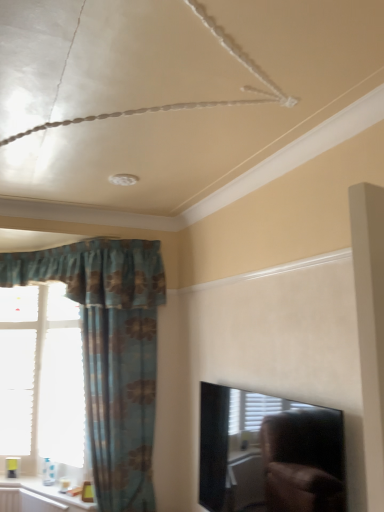
At what (x,y) coordinates should I click in order to perform the action: click on blue floral fabric curtain at left. Please return your answer as a coordinate pair (x, y). Looking at the image, I should click on coord(111,353).

Find the location of a particular element. white paper at left is located at coordinates (41, 377).

The height and width of the screenshot is (512, 384). I want to click on black glossy tv at upper right, so click(269, 454).

Find the location of a particular element. This screenshot has width=384, height=512. blue floral fabric curtain at left is located at coordinates (111, 353).

Can you confirm if white glossy window sill at lower left is thinner than blue floral fabric curtain at left?

No, white glossy window sill at lower left is not thinner than blue floral fabric curtain at left.

Is blue floral fabric curtain at left inside white glossy window sill at lower left?

No, blue floral fabric curtain at left is not a part of white glossy window sill at lower left.

From a real-world perspective, who is located lower, white glossy window sill at lower left or blue floral fabric curtain at left?

white glossy window sill at lower left.

Who is smaller, white paper at left or white glossy window sill at lower left?

white glossy window sill at lower left.

Is white paper at left behind white glossy window sill at lower left?

Yes, it is.

From the image's perspective, is white paper at left under white glossy window sill at lower left?

No.

Is blue floral fabric curtain at left next to white paper at left and touching it?

No, blue floral fabric curtain at left is not with white paper at left.

In the scene shown: Would you say blue floral fabric curtain at left contains white paper at left?

No, white paper at left is not a part of blue floral fabric curtain at left.

From the image's perspective, between blue floral fabric curtain at left and white paper at left, who is located below?

From the image's view, white paper at left is below.

Considering the sizes of blue floral fabric curtain at left and white paper at left in the image, is blue floral fabric curtain at left wider or thinner than white paper at left?

Clearly, blue floral fabric curtain at left has more width compared to white paper at left.

From a real-world perspective, does blue floral fabric curtain at left stand above black glossy tv at upper right?

Yes, from a real-world perspective, blue floral fabric curtain at left is on top of black glossy tv at upper right.

Considering the sizes of objects blue floral fabric curtain at left and black glossy tv at upper right in the image provided, who is smaller, blue floral fabric curtain at left or black glossy tv at upper right?

black glossy tv at upper right is smaller.

From the image's perspective, is blue floral fabric curtain at left below black glossy tv at upper right?

Incorrect, from the image's perspective, blue floral fabric curtain at left is higher than black glossy tv at upper right.

From a real-world perspective, which object rests below the other?

white paper at left is physically lower.

At what (x,y) coordinates should I click in order to perform the action: click on window lying behind the blue floral fabric curtain at left. Please return your answer as a coordinate pair (x, y). Image resolution: width=384 pixels, height=512 pixels. Looking at the image, I should click on (41, 377).

Is white paper at left positioned behind blue floral fabric curtain at left?

Yes, the depth of white paper at left is greater than that of blue floral fabric curtain at left.

Is white paper at left surrounding blue floral fabric curtain at left?

Definitely not — blue floral fabric curtain at left is not inside white paper at left.

In the image, is black glossy tv at upper right positioned in front of or behind blue floral fabric curtain at left?

black glossy tv at upper right is positioned closer to the viewer than blue floral fabric curtain at left.

From a real-world perspective, between black glossy tv at upper right and blue floral fabric curtain at left, who is vertically lower?

black glossy tv at upper right is physically lower.

From the image's perspective, which one is positioned higher, black glossy tv at upper right or blue floral fabric curtain at left?

blue floral fabric curtain at left is shown above in the image.

Considering the relative sizes of white paper at left and black glossy tv at upper right in the image provided, is white paper at left smaller than black glossy tv at upper right?

No, white paper at left is not smaller than black glossy tv at upper right.

Is white paper at left aimed at black glossy tv at upper right?

No, white paper at left is not facing towards black glossy tv at upper right.

What's the angular difference between white paper at left and black glossy tv at upper right's facing directions?

There is a 66-degree angle between the facing directions of white paper at left and black glossy tv at upper right.

Locate an element on the screen. window sill in front of the blue floral fabric curtain at left is located at coordinates (37, 497).

The width and height of the screenshot is (384, 512). Identify the location of window that is on the left side of white glossy window sill at lower left. (41, 377).

Estimate the real-world distances between objects in this image. Which object is closer to black glossy tv at upper right, blue floral fabric curtain at left or white glossy window sill at lower left?

Among the two, blue floral fabric curtain at left is located nearer to black glossy tv at upper right.

Considering their positions, is white paper at left positioned closer to white glossy window sill at lower left than black glossy tv at upper right?

white paper at left is positioned closer to the anchor white glossy window sill at lower left.

Looking at the image, which one is located further to blue floral fabric curtain at left, black glossy tv at upper right or white glossy window sill at lower left?

black glossy tv at upper right is further to blue floral fabric curtain at left.

Considering their positions, is white paper at left positioned closer to blue floral fabric curtain at left than white glossy window sill at lower left?

white paper at left is positioned closer to the anchor blue floral fabric curtain at left.

Estimate the real-world distances between objects in this image. Which object is further from white glossy window sill at lower left, blue floral fabric curtain at left or black glossy tv at upper right?

Among the two, black glossy tv at upper right is located further to white glossy window sill at lower left.

Looking at the image, which one is located further to white paper at left, blue floral fabric curtain at left or white glossy window sill at lower left?

Among the two, white glossy window sill at lower left is located further to white paper at left.

Estimate the real-world distances between objects in this image. Which object is further from white paper at left, black glossy tv at upper right or white glossy window sill at lower left?

The object further to white paper at left is black glossy tv at upper right.

From the image, which object appears to be nearer to white paper at left, blue floral fabric curtain at left or black glossy tv at upper right?

blue floral fabric curtain at left.

You are a GUI agent. You are given a task and a screenshot of the screen. Output one action in this format:
    pyautogui.click(x=<x>, y=<y>)
    Task: Click on the window sill between white paper at left and blue floral fabric curtain at left
    This screenshot has height=512, width=384.
    Given the screenshot: What is the action you would take?
    pyautogui.click(x=37, y=497)

Locate an element on the screen. curtain located between black glossy tv at upper right and white paper at left in the depth direction is located at coordinates (111, 353).

The image size is (384, 512). Find the location of `window sill between black glossy tv at upper right and white paper at left from front to back`. window sill between black glossy tv at upper right and white paper at left from front to back is located at coordinates (37, 497).

At what (x,y) coordinates should I click in order to perform the action: click on curtain between white glossy window sill at lower left and black glossy tv at upper right from left to right. Please return your answer as a coordinate pair (x, y). The height and width of the screenshot is (512, 384). Looking at the image, I should click on (111, 353).